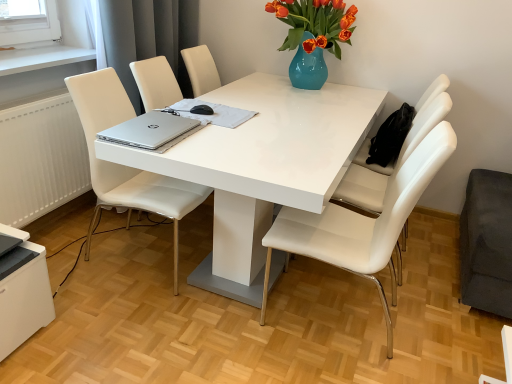
Question: Is silver metallic laptop at center thinner than white glossy desktop at lower left?

Choices:
 (A) no
 (B) yes

Answer: (B)

Question: From a real-world perspective, is silver metallic laptop at center located higher than white glossy desktop at lower left?

Choices:
 (A) no
 (B) yes

Answer: (B)

Question: Does silver metallic laptop at center appear on the left side of white glossy desktop at lower left?

Choices:
 (A) yes
 (B) no

Answer: (B)

Question: Can you confirm if silver metallic laptop at center is taller than white glossy desktop at lower left?

Choices:
 (A) yes
 (B) no

Answer: (B)

Question: Is silver metallic laptop at center wider than white glossy desktop at lower left?

Choices:
 (A) no
 (B) yes

Answer: (A)

Question: Can you confirm if silver metallic laptop at center is bigger than white glossy desktop at lower left?

Choices:
 (A) yes
 (B) no

Answer: (B)

Question: Is gray fabric curtain at upper left shorter than white leather chair at right, acting as the first chair starting from the right?

Choices:
 (A) yes
 (B) no

Answer: (A)

Question: Considering the relative positions of gray fabric curtain at upper left and white leather chair at right, the third chair when ordered from left to right, in the image provided, is gray fabric curtain at upper left to the left of white leather chair at right, the third chair when ordered from left to right, from the viewer's perspective?

Choices:
 (A) yes
 (B) no

Answer: (A)

Question: Is gray fabric curtain at upper left beside white leather chair at right, the third chair when ordered from left to right?

Choices:
 (A) yes
 (B) no

Answer: (B)

Question: Is gray fabric curtain at upper left not near white leather chair at right, acting as the first chair starting from the right?

Choices:
 (A) no
 (B) yes

Answer: (B)

Question: Can you confirm if gray fabric curtain at upper left is wider than white leather chair at right, the third chair when ordered from left to right?

Choices:
 (A) no
 (B) yes

Answer: (A)

Question: Could white leather chair at right, acting as the first chair starting from the right, be considered to be inside gray fabric curtain at upper left?

Choices:
 (A) no
 (B) yes

Answer: (A)

Question: Is white glossy table at center bigger than white leather chair at right, the third chair when ordered from left to right?

Choices:
 (A) yes
 (B) no

Answer: (A)